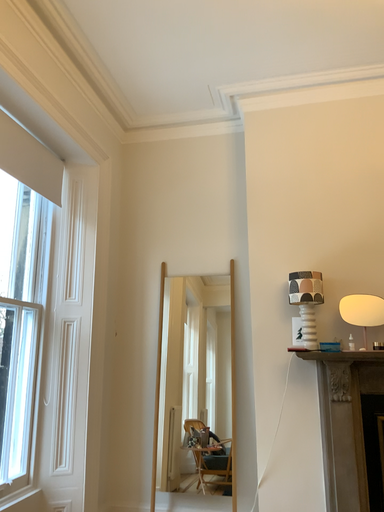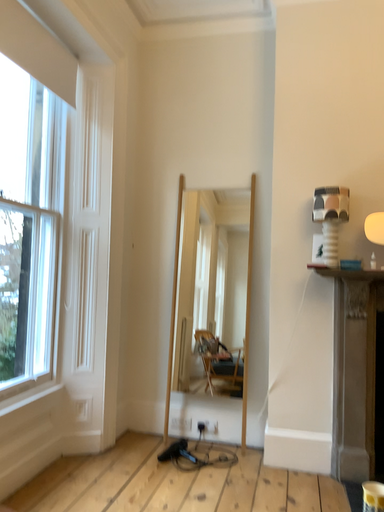
Question: Which way did the camera rotate in the video?

Choices:
 (A) rotated downward
 (B) rotated upward

Answer: (A)